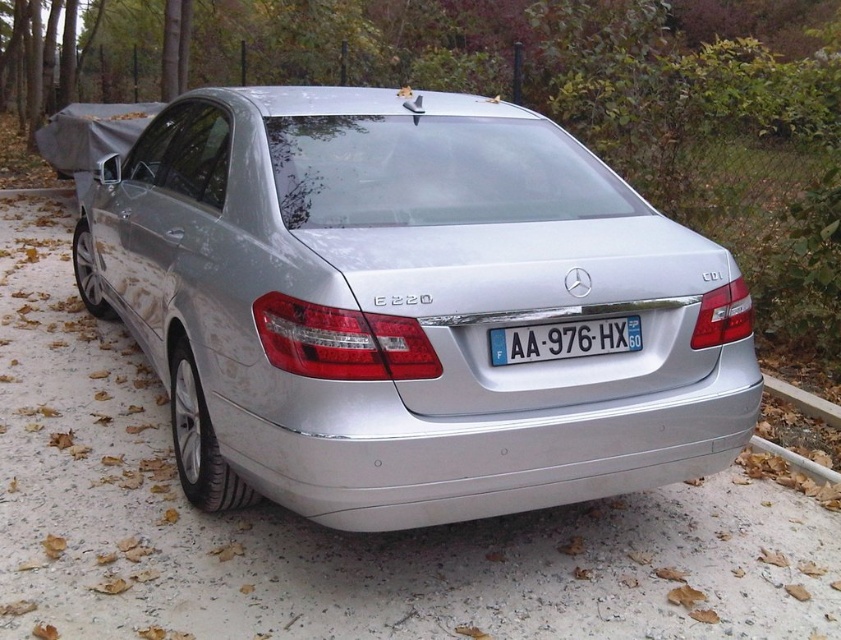
Question: Does white plastic license plate at center have a greater width compared to white plastic pipe at lower right?

Choices:
 (A) yes
 (B) no

Answer: (A)

Question: Estimate the real-world distances between objects in this image. Which object is farther from the white plastic pipe at lower right?

Choices:
 (A) silver metallic car at center
 (B) gray concrete curb at lower right
 (C) white plastic license plate at center

Answer: (A)

Question: Can you confirm if white plastic license plate at center is bigger than gray concrete curb at lower right?

Choices:
 (A) no
 (B) yes

Answer: (A)

Question: Which object appears farthest from the camera in this image?

Choices:
 (A) gray concrete curb at lower right
 (B) silver metallic car at center

Answer: (A)

Question: Can you confirm if silver metallic car at center is bigger than white plastic pipe at lower right?

Choices:
 (A) no
 (B) yes

Answer: (B)

Question: Which point is farther to the camera?

Choices:
 (A) pyautogui.click(x=532, y=362)
 (B) pyautogui.click(x=836, y=426)
 (C) pyautogui.click(x=779, y=456)
 (D) pyautogui.click(x=304, y=378)

Answer: (B)